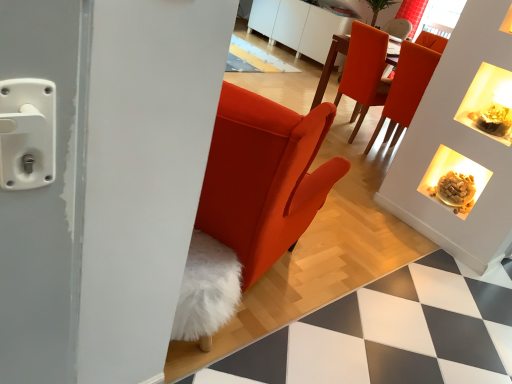
What do you see at coordinates (412, 13) in the screenshot?
I see `red velvet curtain at upper center` at bounding box center [412, 13].

Describe the element at coordinates (454, 180) in the screenshot. The height and width of the screenshot is (384, 512). I see `matte white fireplace at upper right` at that location.

This screenshot has width=512, height=384. Describe the element at coordinates (407, 88) in the screenshot. I see `matte orange chair at upper right, which ranks as the second chair in left-to-right order` at that location.

The width and height of the screenshot is (512, 384). What do you see at coordinates (364, 72) in the screenshot?
I see `matte orange chair at upper right, positioned as the second chair in right-to-left order` at bounding box center [364, 72].

Find the location of a particular element. The image size is (512, 384). matte orange chair at upper right, the first chair viewed from the left is located at coordinates (364, 72).

Where is `red velvet curtain at upper center`? The height and width of the screenshot is (384, 512). red velvet curtain at upper center is located at coordinates (412, 13).

Considering the relative sizes of matte orange chair at upper right, positioned as the second chair in right-to-left order, and red velvet curtain at upper center in the image provided, is matte orange chair at upper right, positioned as the second chair in right-to-left order, taller than red velvet curtain at upper center?

Indeed, matte orange chair at upper right, positioned as the second chair in right-to-left order, has a greater height compared to red velvet curtain at upper center.

Considering the relative sizes of matte orange chair at upper right, positioned as the second chair in right-to-left order, and red velvet curtain at upper center in the image provided, is matte orange chair at upper right, positioned as the second chair in right-to-left order, thinner than red velvet curtain at upper center?

No.

Does point (352, 119) come farther from viewer compared to point (416, 7)?

Yes.

Which object is positioned more to the right, matte orange chair at upper right, the first chair viewed from the left, or red velvet curtain at upper center?

Positioned to the right is red velvet curtain at upper center.

Between matte white fireplace at upper right and matte orange chair at upper right, which appears as the first chair when viewed from the right, which one has more height?

With more height is matte orange chair at upper right, which appears as the first chair when viewed from the right.

This screenshot has width=512, height=384. I want to click on the 2nd chair directly above the matte white fireplace at upper right (from a real-world perspective), so click(407, 88).

Can you tell me how much matte white fireplace at upper right and matte orange chair at upper right, which ranks as the second chair in left-to-right order, differ in facing direction?

They differ by 179 degrees in their facing directions.

Does matte white fireplace at upper right turn towards matte orange chair at upper right, which ranks as the second chair in left-to-right order?

No, matte white fireplace at upper right is not oriented towards matte orange chair at upper right, which ranks as the second chair in left-to-right order.

Is point (419, 16) closer or farther from the camera than point (369, 58)?

Point (419, 16).

Is matte orange chair at upper right, the first chair viewed from the left, completely or partially inside red velvet curtain at upper center?

Actually, matte orange chair at upper right, the first chair viewed from the left, is outside red velvet curtain at upper center.

From a real-world perspective, which object stands above the other?

red velvet curtain at upper center.

Is red velvet curtain at upper center to the left of matte orange chair at upper right, positioned as the second chair in right-to-left order, from the viewer's perspective?

No, red velvet curtain at upper center is not to the left of matte orange chair at upper right, positioned as the second chair in right-to-left order.

Considering the sizes of objects matte orange chair at upper right, the first chair viewed from the left, and matte orange chair at upper right, which ranks as the second chair in left-to-right order, in the image provided, who is shorter, matte orange chair at upper right, the first chair viewed from the left, or matte orange chair at upper right, which ranks as the second chair in left-to-right order,?

With less height is matte orange chair at upper right, the first chair viewed from the left.

Between matte orange chair at upper right, positioned as the second chair in right-to-left order, and matte orange chair at upper right, which appears as the first chair when viewed from the right, which one has larger size?

matte orange chair at upper right, positioned as the second chair in right-to-left order, is bigger.

In the scene shown: Which is less distant, (x=349, y=81) or (x=400, y=55)?

Point (x=349, y=81) is positioned farther from the camera compared to point (x=400, y=55).

Does matte orange chair at upper right, positioned as the second chair in right-to-left order, come in front of matte orange chair at upper right, which ranks as the second chair in left-to-right order?

No, matte orange chair at upper right, positioned as the second chair in right-to-left order, is further to the viewer.

Between red velvet curtain at upper center and matte orange chair at upper right, which ranks as the second chair in left-to-right order, which one is positioned in front?

matte orange chair at upper right, which ranks as the second chair in left-to-right order, is more forward.

In the scene shown: Looking at their sizes, would you say red velvet curtain at upper center is wider or thinner than matte orange chair at upper right, which appears as the first chair when viewed from the right?

Considering their sizes, red velvet curtain at upper center looks slimmer than matte orange chair at upper right, which appears as the first chair when viewed from the right.

From a real-world perspective, which is physically above, red velvet curtain at upper center or matte orange chair at upper right, which ranks as the second chair in left-to-right order?

red velvet curtain at upper center is physically above.

Which is behind, point (407, 11) or point (408, 63)?

The point (407, 11) is behind.

Are matte white fireplace at upper right and red velvet curtain at upper center located far from each other?

matte white fireplace at upper right is positioned a significant distance from red velvet curtain at upper center.

Considering the sizes of matte white fireplace at upper right and red velvet curtain at upper center in the image, is matte white fireplace at upper right taller or shorter than red velvet curtain at upper center?

matte white fireplace at upper right is shorter than red velvet curtain at upper center.

From a real-world perspective, between matte white fireplace at upper right and red velvet curtain at upper center, who is vertically higher?

red velvet curtain at upper center, from a real-world perspective.

Which object is positioned more to the left, matte white fireplace at upper right or red velvet curtain at upper center?

From the viewer's perspective, matte white fireplace at upper right appears more on the left side.

Between matte orange chair at upper right, which ranks as the second chair in left-to-right order, and red velvet curtain at upper center, which one has smaller width?

red velvet curtain at upper center.

Is matte orange chair at upper right, which ranks as the second chair in left-to-right order, in front of or behind red velvet curtain at upper center in the image?

matte orange chair at upper right, which ranks as the second chair in left-to-right order, is positioned closer to the viewer than red velvet curtain at upper center.

Locate an element on the screen. the 1st chair in front of the red velvet curtain at upper center is located at coordinates (364, 72).

I want to click on chair that is the 1st one when counting upward from the matte white fireplace at upper right (from the image's perspective), so click(407, 88).

From the image, which object appears to be farther from matte orange chair at upper right, which appears as the first chair when viewed from the right, red velvet curtain at upper center or matte orange chair at upper right, the first chair viewed from the left?

red velvet curtain at upper center.

Which object lies further to the anchor point matte white fireplace at upper right, red velvet curtain at upper center or matte orange chair at upper right, positioned as the second chair in right-to-left order?

red velvet curtain at upper center lies further to matte white fireplace at upper right than the other object.

Estimate the real-world distances between objects in this image. Which object is further from matte orange chair at upper right, positioned as the second chair in right-to-left order, matte white fireplace at upper right or red velvet curtain at upper center?

Among the two, matte white fireplace at upper right is located further to matte orange chair at upper right, positioned as the second chair in right-to-left order.

From the image, which object appears to be nearer to red velvet curtain at upper center, matte orange chair at upper right, positioned as the second chair in right-to-left order, or matte orange chair at upper right, which appears as the first chair when viewed from the right?

Among the two, matte orange chair at upper right, positioned as the second chair in right-to-left order, is located nearer to red velvet curtain at upper center.

Estimate the real-world distances between objects in this image. Which object is closer to matte white fireplace at upper right, matte orange chair at upper right, which appears as the first chair when viewed from the right, or red velvet curtain at upper center?

The object closer to matte white fireplace at upper right is matte orange chair at upper right, which appears as the first chair when viewed from the right.

When comparing their distances from red velvet curtain at upper center, does matte orange chair at upper right, the first chair viewed from the left, or matte white fireplace at upper right seem closer?

matte orange chair at upper right, the first chair viewed from the left, lies closer to red velvet curtain at upper center than the other object.

Based on their spatial positions, is matte white fireplace at upper right or matte orange chair at upper right, the first chair viewed from the left, closer to matte orange chair at upper right, which appears as the first chair when viewed from the right?

matte orange chair at upper right, the first chair viewed from the left, is positioned closer to the anchor matte orange chair at upper right, which appears as the first chair when viewed from the right.

Based on their spatial positions, is matte white fireplace at upper right or matte orange chair at upper right, which appears as the first chair when viewed from the right, closer to matte orange chair at upper right, positioned as the second chair in right-to-left order?

Based on the image, matte orange chair at upper right, which appears as the first chair when viewed from the right, appears to be nearer to matte orange chair at upper right, positioned as the second chair in right-to-left order.

Where is `chair between matte orange chair at upper right, positioned as the second chair in right-to-left order, and matte white fireplace at upper right in the up-down direction`? The width and height of the screenshot is (512, 384). chair between matte orange chair at upper right, positioned as the second chair in right-to-left order, and matte white fireplace at upper right in the up-down direction is located at coordinates (407, 88).

The image size is (512, 384). In order to click on chair between matte orange chair at upper right, which ranks as the second chair in left-to-right order, and red velvet curtain at upper center in the front-back direction in this screenshot , I will do `click(364, 72)`.